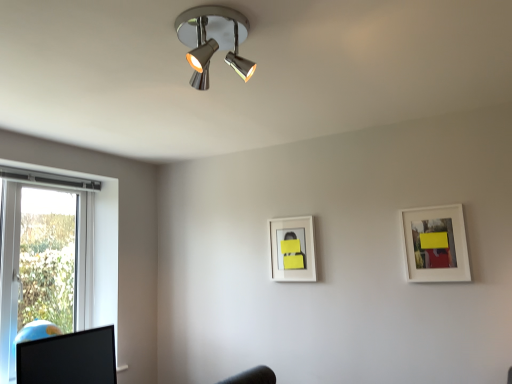
What do you see at coordinates (213, 40) in the screenshot? The height and width of the screenshot is (384, 512). I see `chrome/metallic spotlight at upper center` at bounding box center [213, 40].

What do you see at coordinates (435, 244) in the screenshot? The height and width of the screenshot is (384, 512). I see `white matte picture frame at upper right, which appears as the second picture frame when viewed from the left` at bounding box center [435, 244].

Identify the location of white matte picture frame at center, the first picture frame when ordered from left to right. Image resolution: width=512 pixels, height=384 pixels. (292, 249).

Which of these two, chrome/metallic spotlight at upper center or white matte picture frame at upper right, which is the first picture frame from front to back, is smaller?

white matte picture frame at upper right, which is the first picture frame from front to back, is smaller.

Can you tell me how much chrome/metallic spotlight at upper center and white matte picture frame at upper right, placed as the 2th picture frame when sorted from back to front, differ in facing direction?

0.631 degrees.

In the scene shown: Is chrome/metallic spotlight at upper center taller or shorter than white matte picture frame at upper right, which is the first picture frame from front to back?

In the image, chrome/metallic spotlight at upper center appears to be shorter than white matte picture frame at upper right, which is the first picture frame from front to back.

From the picture: Is chrome/metallic spotlight at upper center positioned far away from white matte picture frame at upper right, which appears as the second picture frame when viewed from the left?

Indeed, chrome/metallic spotlight at upper center is not near white matte picture frame at upper right, which appears as the second picture frame when viewed from the left.

Considering the sizes of objects black glossy computer monitor at lower left and white matte picture frame at upper right, placed as the 2th picture frame when sorted from back to front, in the image provided, who is bigger, black glossy computer monitor at lower left or white matte picture frame at upper right, placed as the 2th picture frame when sorted from back to front,?

Bigger between the two is black glossy computer monitor at lower left.

From the image's perspective, which is above, black glossy computer monitor at lower left or white matte picture frame at upper right, which is the first picture frame from front to back?

white matte picture frame at upper right, which is the first picture frame from front to back.

I want to click on computer monitor below the white matte picture frame at upper right, which appears as the second picture frame when viewed from the left (from a real-world perspective), so click(x=68, y=358).

Is black glossy computer monitor at lower left closer to the viewer compared to white matte picture frame at upper right, placed as the 2th picture frame when sorted from back to front?

Yes, black glossy computer monitor at lower left is closer to the camera.

From the image's perspective, is white matte picture frame at upper right, arranged as the first picture frame when viewed from the right, below white matte picture frame at center, which is the second picture frame from right to left?

No, from the image's perspective, white matte picture frame at upper right, arranged as the first picture frame when viewed from the right, is not beneath white matte picture frame at center, which is the second picture frame from right to left.

Is white matte picture frame at upper right, which appears as the second picture frame when viewed from the left, with white matte picture frame at center, the first picture frame in the back-to-front sequence?

There is a gap between white matte picture frame at upper right, which appears as the second picture frame when viewed from the left, and white matte picture frame at center, the first picture frame in the back-to-front sequence.

Can white matte picture frame at center, which is the second picture frame from right to left, be found inside white matte picture frame at upper right, which appears as the second picture frame when viewed from the left?

No, white matte picture frame at center, which is the second picture frame from right to left, is not a part of white matte picture frame at upper right, which appears as the second picture frame when viewed from the left.

Looking at this image, is white matte picture frame at upper right, placed as the 2th picture frame when sorted from back to front, wider or thinner than chrome/metallic spotlight at upper center?

In the image, white matte picture frame at upper right, placed as the 2th picture frame when sorted from back to front, appears to be more narrow than chrome/metallic spotlight at upper center.

Could you measure the distance between white matte picture frame at upper right, which appears as the second picture frame when viewed from the left, and chrome/metallic spotlight at upper center?

A distance of 4.18 feet exists between white matte picture frame at upper right, which appears as the second picture frame when viewed from the left, and chrome/metallic spotlight at upper center.

From a real-world perspective, relative to chrome/metallic spotlight at upper center, is white matte picture frame at upper right, which is the first picture frame from front to back, vertically above or below?

In terms of real-world spatial position, white matte picture frame at upper right, which is the first picture frame from front to back, is below chrome/metallic spotlight at upper center.

Is white matte picture frame at upper right, placed as the 2th picture frame when sorted from back to front, facing away from chrome/metallic spotlight at upper center?

white matte picture frame at upper right, placed as the 2th picture frame when sorted from back to front, does not have its back to chrome/metallic spotlight at upper center.

Is black glossy computer monitor at lower left inside or outside of white matte picture frame at center, which is the second picture frame from front to back?

The correct answer is: outside.

Is point (42, 383) closer or farther from the camera than point (303, 257)?

Clearly, point (42, 383) is closer to the camera than point (303, 257).

Consider the image. From a real-world perspective, relative to white matte picture frame at center, which is the second picture frame from right to left, is black glossy computer monitor at lower left vertically above or below?

black glossy computer monitor at lower left is situated lower than white matte picture frame at center, which is the second picture frame from right to left, in the real world.

Which object is positioned more to the right, black glossy computer monitor at lower left or white matte picture frame at center, which is the second picture frame from right to left?

Positioned to the right is white matte picture frame at center, which is the second picture frame from right to left.

Is chrome/metallic spotlight at upper center completely or partially outside of white matte picture frame at center, the first picture frame when ordered from left to right?

Indeed, chrome/metallic spotlight at upper center is completely outside white matte picture frame at center, the first picture frame when ordered from left to right.

Is point (218, 20) positioned after point (295, 219)?

No.

How different are the orientations of chrome/metallic spotlight at upper center and white matte picture frame at center, the first picture frame when ordered from left to right, in degrees?

The angular difference between chrome/metallic spotlight at upper center and white matte picture frame at center, the first picture frame when ordered from left to right, is 0.632 degrees.

Is point (424, 217) positioned behind point (42, 362)?

Yes, point (424, 217) is farther from viewer.

Is white matte picture frame at upper right, which appears as the second picture frame when viewed from the left, bigger or smaller than black glossy computer monitor at lower left?

Clearly, white matte picture frame at upper right, which appears as the second picture frame when viewed from the left, is smaller in size than black glossy computer monitor at lower left.

Considering the positions of objects white matte picture frame at upper right, which is the first picture frame from front to back, and black glossy computer monitor at lower left in the image provided, who is more to the right, white matte picture frame at upper right, which is the first picture frame from front to back, or black glossy computer monitor at lower left?

Positioned to the right is white matte picture frame at upper right, which is the first picture frame from front to back.

Is white matte picture frame at upper right, which is the first picture frame from front to back, in front of or behind black glossy computer monitor at lower left in the image?

Clearly, white matte picture frame at upper right, which is the first picture frame from front to back, is behind black glossy computer monitor at lower left.

Find the location of a particular element. Image resolution: width=512 pixels, height=384 pixels. the 2nd picture frame to the right of the chrome/metallic spotlight at upper center, starting your count from the anchor is located at coordinates (435, 244).

Identify the location of computer monitor that appears below the white matte picture frame at upper right, which is the first picture frame from front to back (from a real-world perspective). (68, 358).

Estimate the real-world distances between objects in this image. Which object is closer to white matte picture frame at upper right, which appears as the second picture frame when viewed from the left, white matte picture frame at center, which is the second picture frame from right to left, or black glossy computer monitor at lower left?

white matte picture frame at center, which is the second picture frame from right to left, lies closer to white matte picture frame at upper right, which appears as the second picture frame when viewed from the left, than the other object.

Which object lies further to the anchor point white matte picture frame at center, which is the second picture frame from right to left, white matte picture frame at upper right, arranged as the first picture frame when viewed from the right, or chrome/metallic spotlight at upper center?

Based on the image, chrome/metallic spotlight at upper center appears to be further to white matte picture frame at center, which is the second picture frame from right to left.

Estimate the real-world distances between objects in this image. Which object is closer to black glossy computer monitor at lower left, white matte picture frame at center, which is the second picture frame from front to back, or white matte picture frame at upper right, which is the first picture frame from front to back?

white matte picture frame at center, which is the second picture frame from front to back.

From the image, which object appears to be farther from black glossy computer monitor at lower left, chrome/metallic spotlight at upper center or white matte picture frame at upper right, arranged as the first picture frame when viewed from the right?

The object further to black glossy computer monitor at lower left is white matte picture frame at upper right, arranged as the first picture frame when viewed from the right.

When comparing their distances from black glossy computer monitor at lower left, does white matte picture frame at upper right, arranged as the first picture frame when viewed from the right, or white matte picture frame at center, which is the second picture frame from front to back, seem further?

white matte picture frame at upper right, arranged as the first picture frame when viewed from the right, is further to black glossy computer monitor at lower left.

Looking at the image, which one is located closer to white matte picture frame at upper right, which is the first picture frame from front to back, white matte picture frame at center, which is the second picture frame from right to left, or chrome/metallic spotlight at upper center?

white matte picture frame at center, which is the second picture frame from right to left, is positioned closer to the anchor white matte picture frame at upper right, which is the first picture frame from front to back.

Based on their spatial positions, is chrome/metallic spotlight at upper center or black glossy computer monitor at lower left further from white matte picture frame at upper right, arranged as the first picture frame when viewed from the right?

Among the two, black glossy computer monitor at lower left is located further to white matte picture frame at upper right, arranged as the first picture frame when viewed from the right.

Looking at the image, which one is located closer to black glossy computer monitor at lower left, white matte picture frame at upper right, placed as the 2th picture frame when sorted from back to front, or chrome/metallic spotlight at upper center?

chrome/metallic spotlight at upper center is positioned closer to the anchor black glossy computer monitor at lower left.

Identify the location of lamp between black glossy computer monitor at lower left and white matte picture frame at upper right, which is the first picture frame from front to back, from left to right. The width and height of the screenshot is (512, 384). (213, 40).

In order to click on picture frame between black glossy computer monitor at lower left and white matte picture frame at upper right, which is the first picture frame from front to back, from left to right in this screenshot , I will do `click(292, 249)`.

Where is `picture frame positioned between chrome/metallic spotlight at upper center and white matte picture frame at center, the first picture frame when ordered from left to right, from near to far`? picture frame positioned between chrome/metallic spotlight at upper center and white matte picture frame at center, the first picture frame when ordered from left to right, from near to far is located at coordinates tap(435, 244).

The image size is (512, 384). Find the location of `computer monitor between chrome/metallic spotlight at upper center and white matte picture frame at center, which is the second picture frame from front to back, from front to back`. computer monitor between chrome/metallic spotlight at upper center and white matte picture frame at center, which is the second picture frame from front to back, from front to back is located at coordinates (68, 358).